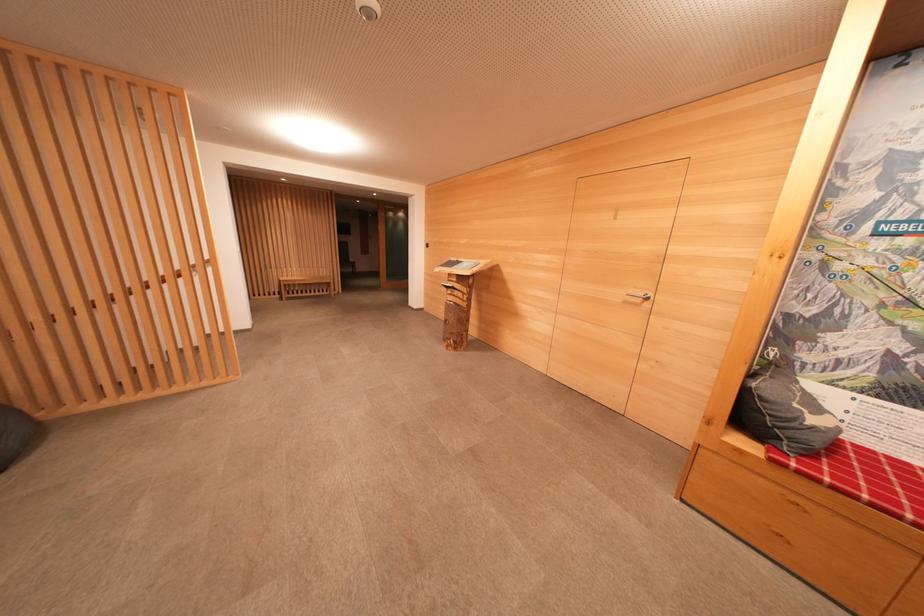
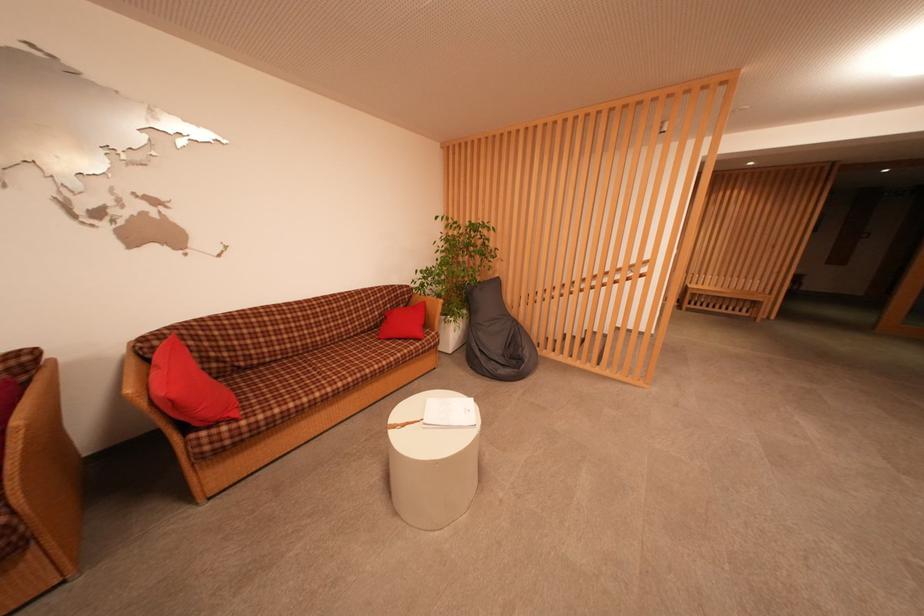
Question: The camera is either moving clockwise (left) or counter-clockwise (right) around the object. The first image is from the beginning of the video and the second image is from the end. Is the camera moving left or right when shooting the video?

Choices:
 (A) Left
 (B) Right

Answer: (B)